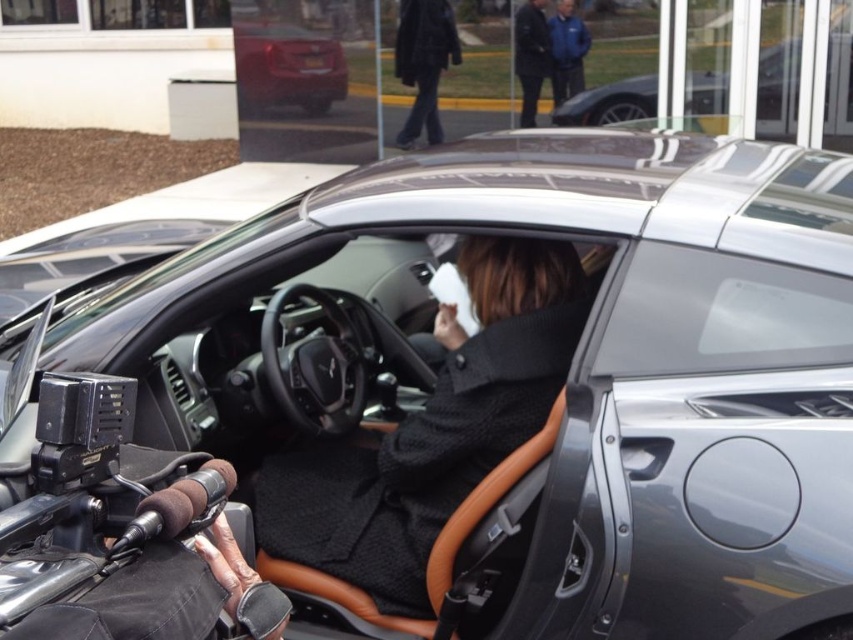
Question: Which point is closer to the camera taking this photo?

Choices:
 (A) (838, 90)
 (B) (531, 60)

Answer: (A)

Question: Does shiny metallic car at upper center appear under blue fabric jacket at upper center?

Choices:
 (A) no
 (B) yes

Answer: (B)

Question: Which object is farther from the camera taking this photo?

Choices:
 (A) shiny red car at upper left
 (B) dark gray pants at upper center
 (C) dark blue jacket at upper center

Answer: (A)

Question: Does shiny metallic car at upper center have a greater width compared to blue fabric jacket at upper center?

Choices:
 (A) no
 (B) yes

Answer: (B)

Question: Which of the following is the farthest from the observer?

Choices:
 (A) (531, 70)
 (B) (299, 560)

Answer: (A)

Question: Is dark gray pants at upper center further to the viewer compared to blue fabric jacket at upper center?

Choices:
 (A) no
 (B) yes

Answer: (B)